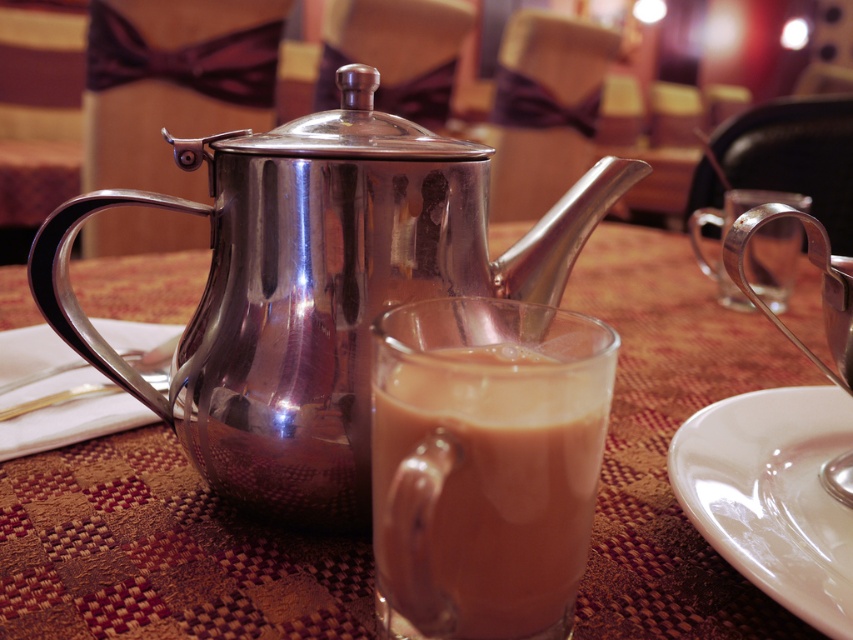
Which of these two, polished metal teapot at center or white glossy saucer at lower right, stands taller?

Standing taller between the two is polished metal teapot at center.

Measure the distance between point (318, 259) and camera.

27.81 centimeters

Which is behind, point (288, 148) or point (682, 440)?

The point (682, 440) is behind.

This screenshot has height=640, width=853. I want to click on polished metal teapot at center, so click(x=316, y=289).

Is brushed metal teapot at center wider than brown frothy liquid at center?

Yes.

Consider the image. Is brushed metal teapot at center to the left of brown frothy liquid at center from the viewer's perspective?

No, brushed metal teapot at center is not to the left of brown frothy liquid at center.

Who is more distant from viewer, [614,634] or [463,518]?

Point [614,634]

Where is `brushed metal teapot at center`? brushed metal teapot at center is located at coordinates (161, 552).

Does brushed metal teapot at center have a greater width compared to polished metal teapot at center?

Correct, the width of brushed metal teapot at center exceeds that of polished metal teapot at center.

Does brushed metal teapot at center have a smaller size compared to polished metal teapot at center?

No.

Which is behind, point (167, 468) or point (67, 332)?

Point (167, 468)

This screenshot has width=853, height=640. In order to click on brushed metal teapot at center in this screenshot , I will do `click(161, 552)`.